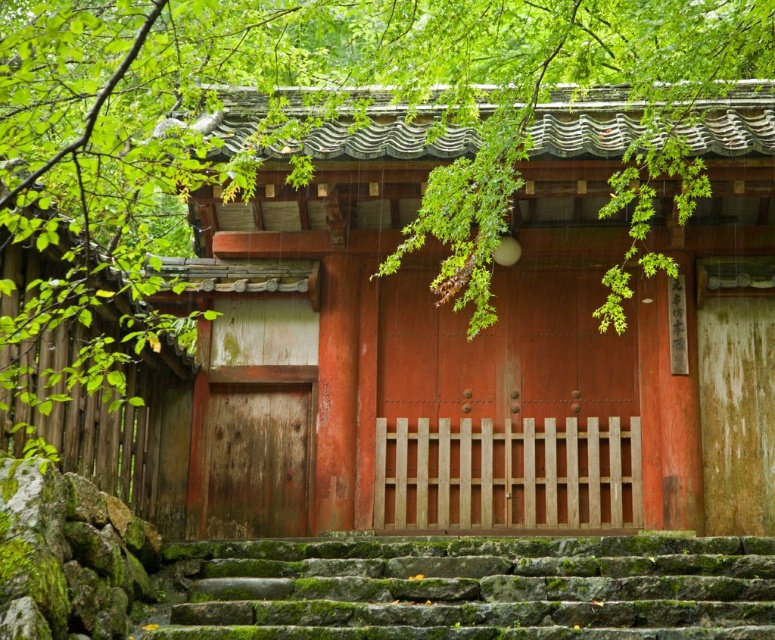
Can you confirm if green leafy branch at upper center is thinner than wooden gate at center?

Incorrect, green leafy branch at upper center's width is not less than wooden gate at center's.

Measure the distance between green leafy branch at upper center and camera.

The distance of green leafy branch at upper center from camera is 20.19 meters.

Which is behind, point (98, 81) or point (629, 365)?

The point (629, 365) is behind.

This screenshot has height=640, width=775. I want to click on green leafy branch at upper center, so click(x=362, y=106).

Can you confirm if green leafy branch at upper center is positioned to the right of green mossy stone stairs at lower center?

Incorrect, green leafy branch at upper center is not on the right side of green mossy stone stairs at lower center.

Image resolution: width=775 pixels, height=640 pixels. I want to click on green leafy branch at upper center, so click(362, 106).

Who is more distant from viewer, (760, 26) or (170, 625)?

Positioned behind is point (760, 26).

Image resolution: width=775 pixels, height=640 pixels. Find the location of `green leafy branch at upper center`. green leafy branch at upper center is located at coordinates (362, 106).

Which is below, green mossy stone stairs at lower center or wooden gate at center?

green mossy stone stairs at lower center is below.

Between green mossy stone stairs at lower center and wooden gate at center, which one appears on the right side from the viewer's perspective?

wooden gate at center

This screenshot has height=640, width=775. Identify the location of green mossy stone stairs at lower center. click(x=477, y=588).